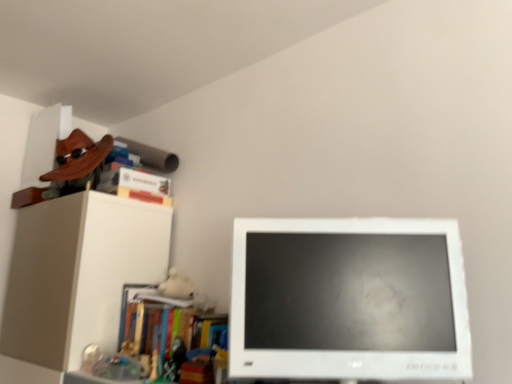
Question: In the image, is multicolored plastic books at left, marked as the fourth book in a top-to-bottom arrangement, positioned in front of or behind hardcover book at upper left, the second book positioned from the bottom?

Choices:
 (A) front
 (B) behind

Answer: (A)

Question: In terms of size, does multicolored plastic books at left, the first book positioned from the bottom, appear bigger or smaller than hardcover book at upper left, which is the 3th book from top to bottom?

Choices:
 (A) big
 (B) small

Answer: (A)

Question: Considering the real-world distances, which object is closest to the multicolored plastic books at left, the first book positioned from the bottom?

Choices:
 (A) hardcover book at upper left, which is the 3th book from top to bottom
 (B) white glossy computer monitor at center
 (C) hardcover book at upper left, the third book positioned from the bottom
 (D) wooden skateboard at upper left, marked as the 1th book in a top-to-bottom arrangement

Answer: (A)

Question: Estimate the real-world distances between objects in this image. Which object is closer to the multicolored plastic books at left, marked as the fourth book in a top-to-bottom arrangement?

Choices:
 (A) hardcover book at upper left, the second book positioned from the bottom
 (B) wooden skateboard at upper left, marked as the 1th book in a top-to-bottom arrangement
 (C) hardcover book at upper left, the third book positioned from the bottom
 (D) white glossy computer monitor at center

Answer: (A)